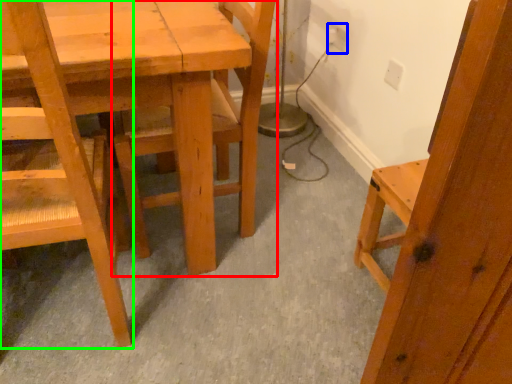
Question: Which object is positioned closest to chair (highlighted by a red box)? Select from electric outlet (highlighted by a blue box) and chair (highlighted by a green box).

Choices:
 (A) electric outlet
 (B) chair

Answer: (B)